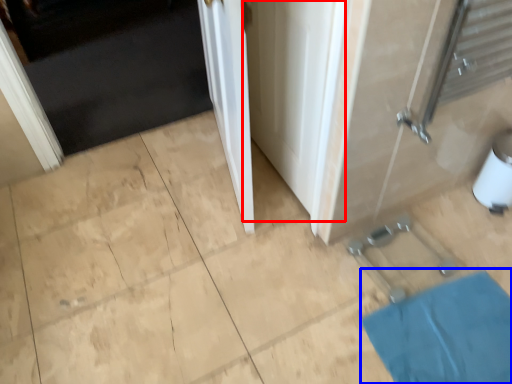
Question: Which of the following is the closest to the observer, screen door (highlighted by a red box) or bath mat (highlighted by a blue box)?

Choices:
 (A) screen door
 (B) bath mat

Answer: (A)